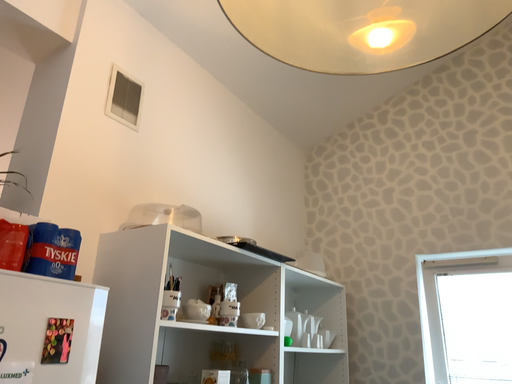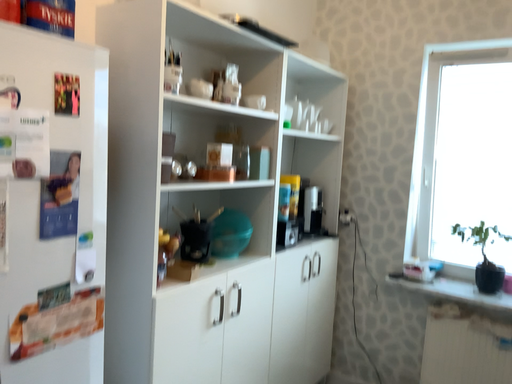
Question: How did the camera likely rotate when shooting the video?

Choices:
 (A) rotated upward
 (B) rotated downward

Answer: (B)